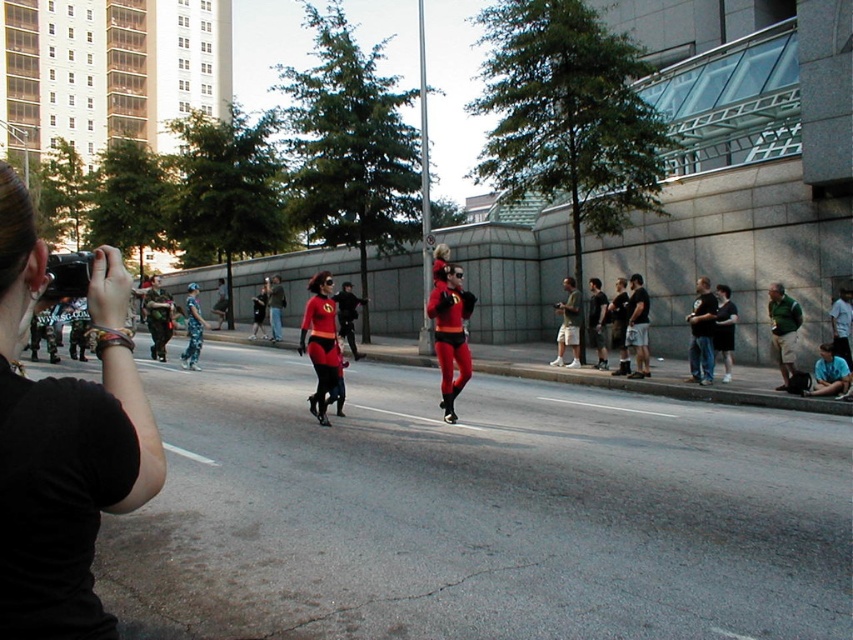
You are a photographer standing in the scene and want to frame the dark gray shorts at right in your shot. What coordinates should you aim for to center them?

The dark gray shorts at right are located at coordinates 0.511 on the x and 0.749 on the y axis, so centering the shot at those coordinates would frame them properly.